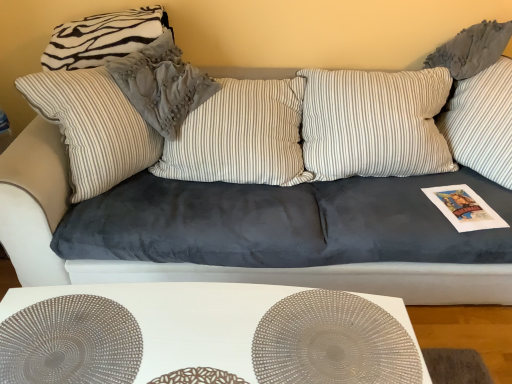
Image resolution: width=512 pixels, height=384 pixels. I want to click on striped fabric pillow at upper left, arranged as the second pillow when viewed from the left, so click(161, 84).

What is the approximate width of zebra-patterned fabric pillow at upper left, which is counted as the 1th pillow, starting from the left?

zebra-patterned fabric pillow at upper left, which is counted as the 1th pillow, starting from the left, is 25.97 centimeters wide.

I want to click on white matte table at lower center, so click(204, 335).

In the scene shown: Is satin silver circle at center, marked as the second circle in a right-to-left arrangement, surrounding white matte table at lower center?

No, white matte table at lower center is located outside of satin silver circle at center, marked as the second circle in a right-to-left arrangement.

Between satin silver circle at center, which is the first circle from left to right, and white matte table at lower center, which one has larger width?

satin silver circle at center, which is the first circle from left to right.

Considering the relative positions of satin silver circle at center, marked as the second circle in a right-to-left arrangement, and white matte table at lower center in the image provided, is satin silver circle at center, marked as the second circle in a right-to-left arrangement, in front of white matte table at lower center?

Yes, the depth of satin silver circle at center, marked as the second circle in a right-to-left arrangement, is less than that of white matte table at lower center.

Does satin silver circle at center, marked as the second circle in a right-to-left arrangement, have a smaller size compared to white matte table at lower center?

Correct, satin silver circle at center, marked as the second circle in a right-to-left arrangement, occupies less space than white matte table at lower center.

Is white matte table at lower center not close to zebra-patterned fabric pillow at upper left, which is counted as the 1th pillow, starting from the left?

white matte table at lower center is positioned a significant distance from zebra-patterned fabric pillow at upper left, which is counted as the 1th pillow, starting from the left.

From the image's perspective, does white matte table at lower center appear higher than zebra-patterned fabric pillow at upper left, which is counted as the 1th pillow, starting from the left?

Actually, white matte table at lower center appears below zebra-patterned fabric pillow at upper left, which is counted as the 1th pillow, starting from the left, in the image.

Which of these two, white matte table at lower center or zebra-patterned fabric pillow at upper left, which is counted as the 1th pillow, starting from the left, is bigger?

white matte table at lower center is bigger.

Based on the photo, between white matte table at lower center and zebra-patterned fabric pillow at upper left, which is counted as the 1th pillow, starting from the left, which one appears on the left side from the viewer's perspective?

Positioned to the left is zebra-patterned fabric pillow at upper left, which is counted as the 1th pillow, starting from the left.

Does translucent plastic circle at center, marked as the second circle in a left-to-right arrangement, turn towards white matte table at lower center?

Yes, translucent plastic circle at center, marked as the second circle in a left-to-right arrangement, is oriented towards white matte table at lower center.

Between translucent plastic circle at center, the 1th circle positioned from the right, and white matte table at lower center, which one is positioned in front?

translucent plastic circle at center, the 1th circle positioned from the right.

From the image's perspective, starting from the white matte table at lower center, which circle is the 1st one above? Please provide its 2D coordinates.

[(332, 342)]

Is point (322, 315) positioned before point (255, 344)?

No, it is behind (255, 344).

Which object is more forward, translucent plastic circle at center, marked as the second circle in a left-to-right arrangement, or zebra-patterned fabric pillow at upper left, which is counted as the 1th pillow, starting from the left?

translucent plastic circle at center, marked as the second circle in a left-to-right arrangement, is more forward.

Is translucent plastic circle at center, the 1th circle positioned from the right, to the right of zebra-patterned fabric pillow at upper left, which ranks as the second pillow in right-to-left order, from the viewer's perspective?

Yes, translucent plastic circle at center, the 1th circle positioned from the right, is to the right of zebra-patterned fabric pillow at upper left, which ranks as the second pillow in right-to-left order.

Looking at their sizes, would you say translucent plastic circle at center, marked as the second circle in a left-to-right arrangement, is wider or thinner than zebra-patterned fabric pillow at upper left, which is counted as the 1th pillow, starting from the left?

Considering their sizes, translucent plastic circle at center, marked as the second circle in a left-to-right arrangement, looks broader than zebra-patterned fabric pillow at upper left, which is counted as the 1th pillow, starting from the left.

Considering the sizes of objects translucent plastic circle at center, the 1th circle positioned from the right, and zebra-patterned fabric pillow at upper left, which is counted as the 1th pillow, starting from the left, in the image provided, who is bigger, translucent plastic circle at center, the 1th circle positioned from the right, or zebra-patterned fabric pillow at upper left, which is counted as the 1th pillow, starting from the left,?

Bigger between the two is zebra-patterned fabric pillow at upper left, which is counted as the 1th pillow, starting from the left.

Between white matte table at lower center and translucent plastic circle at center, the 1th circle positioned from the right, which one appears on the right side from the viewer's perspective?

From the viewer's perspective, translucent plastic circle at center, the 1th circle positioned from the right, appears more on the right side.

Considering the sizes of white matte table at lower center and translucent plastic circle at center, marked as the second circle in a left-to-right arrangement, in the image, is white matte table at lower center bigger or smaller than translucent plastic circle at center, marked as the second circle in a left-to-right arrangement,?

Clearly, white matte table at lower center is larger in size than translucent plastic circle at center, marked as the second circle in a left-to-right arrangement.

Which is farther, [141,294] or [287,317]?

Positioned behind is point [141,294].

Considering the relative sizes of zebra-patterned fabric pillow at upper left, which ranks as the second pillow in right-to-left order, and satin silver circle at center, which is the first circle from left to right, in the image provided, is zebra-patterned fabric pillow at upper left, which ranks as the second pillow in right-to-left order, smaller than satin silver circle at center, which is the first circle from left to right,?

Incorrect, zebra-patterned fabric pillow at upper left, which ranks as the second pillow in right-to-left order, is not smaller in size than satin silver circle at center, which is the first circle from left to right.

Are zebra-patterned fabric pillow at upper left, which ranks as the second pillow in right-to-left order, and satin silver circle at center, which is the first circle from left to right, making contact?

zebra-patterned fabric pillow at upper left, which ranks as the second pillow in right-to-left order, is not next to satin silver circle at center, which is the first circle from left to right, and they're not touching.

Considering the relative sizes of zebra-patterned fabric pillow at upper left, which is counted as the 1th pillow, starting from the left, and satin silver circle at center, marked as the second circle in a right-to-left arrangement, in the image provided, is zebra-patterned fabric pillow at upper left, which is counted as the 1th pillow, starting from the left, taller than satin silver circle at center, marked as the second circle in a right-to-left arrangement,?

Yes, zebra-patterned fabric pillow at upper left, which is counted as the 1th pillow, starting from the left, is taller than satin silver circle at center, marked as the second circle in a right-to-left arrangement.

Does white matte table at lower center lie in front of satin silver circle at center, marked as the second circle in a right-to-left arrangement?

No, the depth of white matte table at lower center is greater than that of satin silver circle at center, marked as the second circle in a right-to-left arrangement.

Consider the image. Can you confirm if white matte table at lower center is smaller than satin silver circle at center, which is the first circle from left to right?

No, white matte table at lower center is not smaller than satin silver circle at center, which is the first circle from left to right.

Considering the sizes of objects white matte table at lower center and satin silver circle at center, marked as the second circle in a right-to-left arrangement, in the image provided, who is shorter, white matte table at lower center or satin silver circle at center, marked as the second circle in a right-to-left arrangement,?

With less height is satin silver circle at center, marked as the second circle in a right-to-left arrangement.

Does white matte table at lower center have a lesser width compared to satin silver circle at center, which is the first circle from left to right?

Yes.

The width and height of the screenshot is (512, 384). I want to click on the 1st circle located above the white matte table at lower center (from a real-world perspective), so click(x=70, y=342).

The height and width of the screenshot is (384, 512). Find the location of `the 2nd pillow above when counting from the white matte table at lower center (from the image's perspective)`. the 2nd pillow above when counting from the white matte table at lower center (from the image's perspective) is located at coordinates (103, 38).

In the scene shown: Based on their spatial positions, is translucent plastic circle at center, marked as the second circle in a left-to-right arrangement, or striped fabric pillow at upper left, which ranks as the 1th pillow in right-to-left order, closer to white matte table at lower center?

Based on the image, translucent plastic circle at center, marked as the second circle in a left-to-right arrangement, appears to be nearer to white matte table at lower center.

Estimate the real-world distances between objects in this image. Which object is further from zebra-patterned fabric pillow at upper left, which ranks as the second pillow in right-to-left order, satin silver circle at center, which is the first circle from left to right, or translucent plastic circle at center, the 1th circle positioned from the right?

translucent plastic circle at center, the 1th circle positioned from the right, is further to zebra-patterned fabric pillow at upper left, which ranks as the second pillow in right-to-left order.

When comparing their distances from striped fabric pillow at upper left, which ranks as the 1th pillow in right-to-left order, does white matte table at lower center or zebra-patterned fabric pillow at upper left, which ranks as the second pillow in right-to-left order, seem further?

Among the two, white matte table at lower center is located further to striped fabric pillow at upper left, which ranks as the 1th pillow in right-to-left order.

Looking at this image, when comparing their distances from striped fabric pillow at upper left, which ranks as the 1th pillow in right-to-left order, does satin silver circle at center, which is the first circle from left to right, or zebra-patterned fabric pillow at upper left, which is counted as the 1th pillow, starting from the left, seem further?

satin silver circle at center, which is the first circle from left to right, is further to striped fabric pillow at upper left, which ranks as the 1th pillow in right-to-left order.

Estimate the real-world distances between objects in this image. Which object is further from zebra-patterned fabric pillow at upper left, which ranks as the second pillow in right-to-left order, white matte table at lower center or satin silver circle at center, which is the first circle from left to right?

white matte table at lower center lies further to zebra-patterned fabric pillow at upper left, which ranks as the second pillow in right-to-left order, than the other object.

Consider the image. Estimate the real-world distances between objects in this image. Which object is further from translucent plastic circle at center, marked as the second circle in a left-to-right arrangement, satin silver circle at center, which is the first circle from left to right, or striped fabric pillow at upper left, which ranks as the 1th pillow in right-to-left order?

striped fabric pillow at upper left, which ranks as the 1th pillow in right-to-left order, is further to translucent plastic circle at center, marked as the second circle in a left-to-right arrangement.

Considering their positions, is translucent plastic circle at center, marked as the second circle in a left-to-right arrangement, positioned closer to striped fabric pillow at upper left, which ranks as the 1th pillow in right-to-left order, than satin silver circle at center, which is the first circle from left to right?

satin silver circle at center, which is the first circle from left to right, lies closer to striped fabric pillow at upper left, which ranks as the 1th pillow in right-to-left order, than the other object.

Which object lies further to the anchor point satin silver circle at center, marked as the second circle in a right-to-left arrangement, white matte table at lower center or striped fabric pillow at upper left, arranged as the second pillow when viewed from the left?

striped fabric pillow at upper left, arranged as the second pillow when viewed from the left, is positioned further to the anchor satin silver circle at center, marked as the second circle in a right-to-left arrangement.

Locate an element on the screen. The height and width of the screenshot is (384, 512). pillow that lies between zebra-patterned fabric pillow at upper left, which is counted as the 1th pillow, starting from the left, and white matte table at lower center from top to bottom is located at coordinates (161, 84).

Where is `pillow between zebra-patterned fabric pillow at upper left, which is counted as the 1th pillow, starting from the left, and translucent plastic circle at center, the 1th circle positioned from the right, in the vertical direction`? pillow between zebra-patterned fabric pillow at upper left, which is counted as the 1th pillow, starting from the left, and translucent plastic circle at center, the 1th circle positioned from the right, in the vertical direction is located at coordinates (161, 84).

At what (x,y) coordinates should I click in order to perform the action: click on table between satin silver circle at center, marked as the second circle in a right-to-left arrangement, and translucent plastic circle at center, the 1th circle positioned from the right, in the horizontal direction. Please return your answer as a coordinate pair (x, y). This screenshot has height=384, width=512. Looking at the image, I should click on (204, 335).

Where is `circle between zebra-patterned fabric pillow at upper left, which ranks as the second pillow in right-to-left order, and translucent plastic circle at center, marked as the second circle in a left-to-right arrangement, from top to bottom`? This screenshot has height=384, width=512. circle between zebra-patterned fabric pillow at upper left, which ranks as the second pillow in right-to-left order, and translucent plastic circle at center, marked as the second circle in a left-to-right arrangement, from top to bottom is located at coordinates (70, 342).